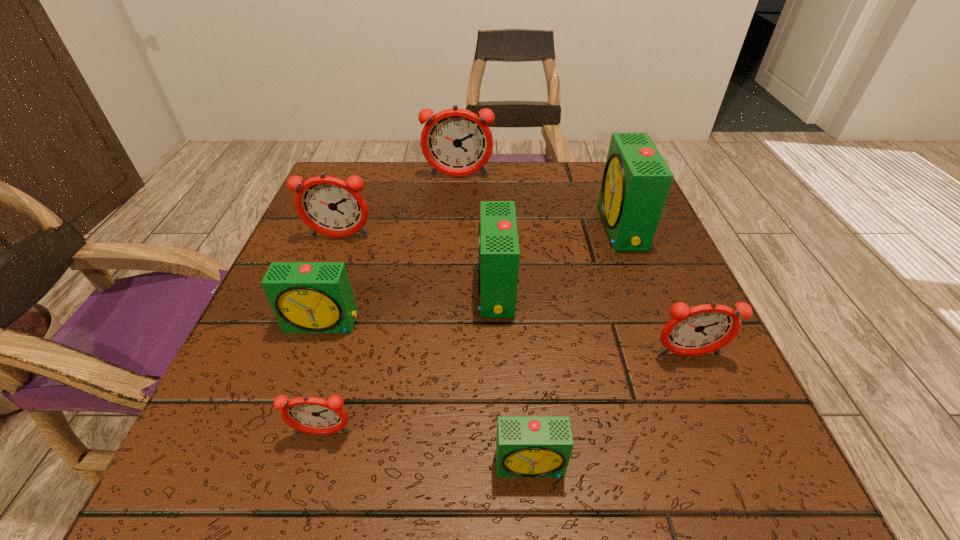
Where is `the third reddish-pink alarm clock from left to right`? The width and height of the screenshot is (960, 540). the third reddish-pink alarm clock from left to right is located at coordinates (457, 142).

Find the location of a particular element. This screenshot has height=540, width=960. the farthest reddish-pink alarm clock is located at coordinates (457, 142).

This screenshot has width=960, height=540. I want to click on the rightmost green alarm clock, so click(636, 181).

Where is `the farthest green alarm clock`? the farthest green alarm clock is located at coordinates (636, 181).

You are a GUI agent. You are given a task and a screenshot of the screen. Output one action in this format:
    pyautogui.click(x=<x>, y=<y>)
    Task: Click on the third smallest reddish-pink alarm clock
    
    Given the screenshot: What is the action you would take?
    pyautogui.click(x=330, y=206)

Image resolution: width=960 pixels, height=540 pixels. I want to click on the third smallest green alarm clock, so click(498, 245).

The image size is (960, 540). Identify the location of the sixth farthest object. (702, 329).

Find the location of a particular element. the second smallest reddish-pink alarm clock is located at coordinates (702, 329).

Where is `the leftmost green alarm clock`? The width and height of the screenshot is (960, 540). the leftmost green alarm clock is located at coordinates (307, 297).

Locate an element on the screen. The width and height of the screenshot is (960, 540). the seventh farthest alarm clock is located at coordinates (312, 415).